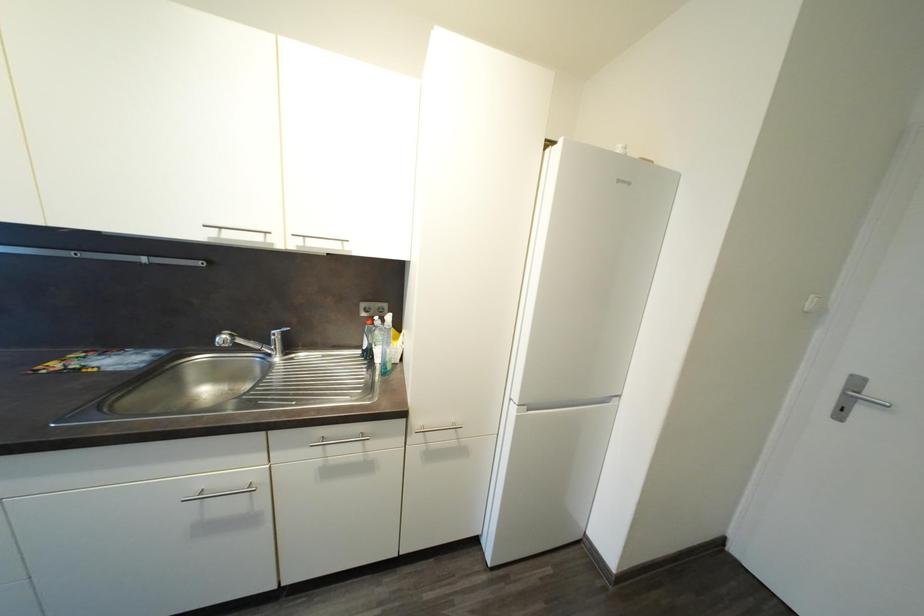
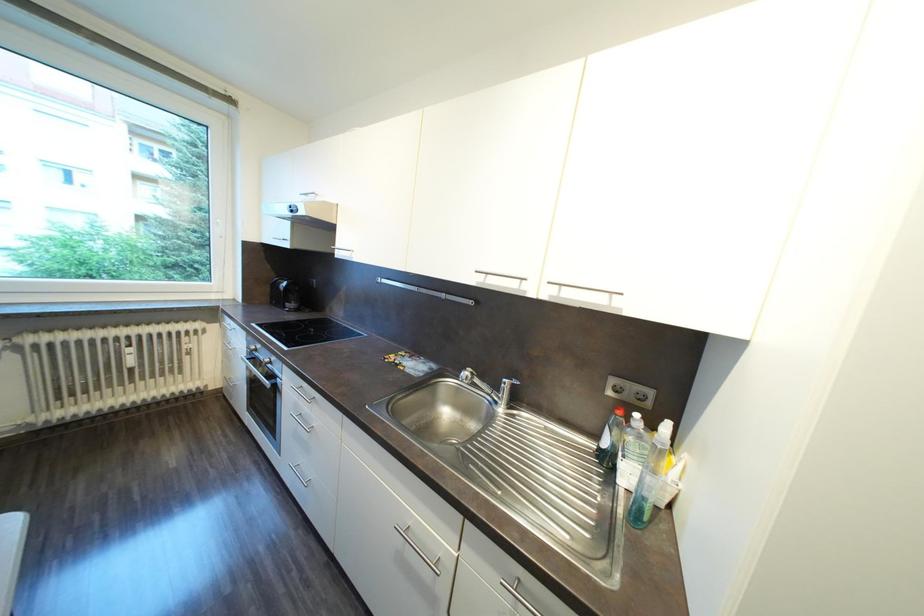
Question: The camera is either moving clockwise (left) or counter-clockwise (right) around the object. The first image is from the beginning of the video and the second image is from the end. Is the camera moving left or right when shooting the video?

Choices:
 (A) Left
 (B) Right

Answer: (B)